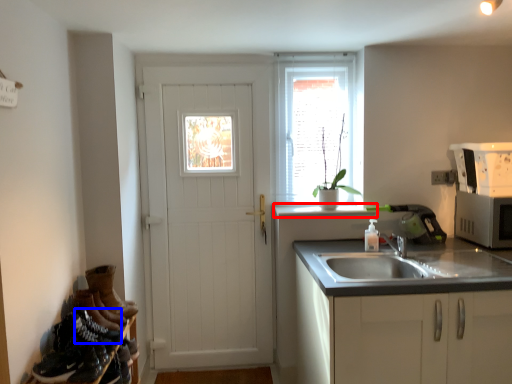
Question: Which of the following is the closest to the observer, window sill (highlighted by a red box) or shoe (highlighted by a blue box)?

Choices:
 (A) window sill
 (B) shoe

Answer: (B)